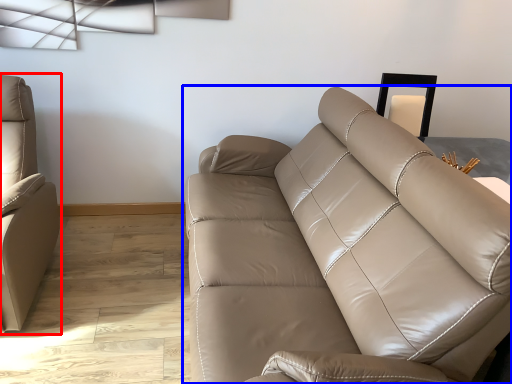
Question: Which of the following is the closest to the observer, studio couch (highlighted by a red box) or studio couch (highlighted by a blue box)?

Choices:
 (A) studio couch
 (B) studio couch

Answer: (B)